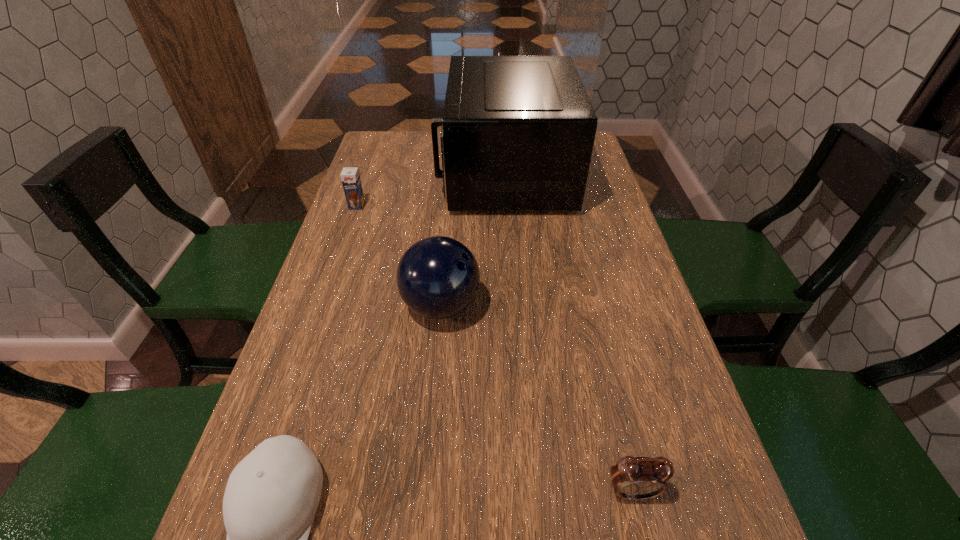
Find the location of `unoccupied area between the second tallest object and the chocolate milk`. unoccupied area between the second tallest object and the chocolate milk is located at coordinates (399, 256).

This screenshot has height=540, width=960. I want to click on free space between the alarm clock and the tallest object, so click(568, 332).

The width and height of the screenshot is (960, 540). Find the location of `vacant area between the alarm clock and the chocolate milk`. vacant area between the alarm clock and the chocolate milk is located at coordinates (494, 348).

What are the coordinates of `unoccupied position between the alarm clock and the microwave_oven` in the screenshot? It's located at (568, 332).

Locate an element on the screen. Image resolution: width=960 pixels, height=540 pixels. empty space between the alarm clock and the third nearest object is located at coordinates [537, 398].

You are a GUI agent. You are given a task and a screenshot of the screen. Output one action in this format:
    pyautogui.click(x=<x>, y=<y>)
    Task: Click on the object that stands as the third closest to the chocolate milk
    This screenshot has width=960, height=540.
    Given the screenshot: What is the action you would take?
    pyautogui.click(x=271, y=497)

What are the coordinates of `object that can be found as the fourth closest to the alarm clock` in the screenshot? It's located at (350, 177).

The width and height of the screenshot is (960, 540). What are the coordinates of `vacant region that satisfies the following two spatial constraints: 1. on the front-facing side of the tallest object; 2. on the front label of the chocolate milk` in the screenshot? It's located at (506, 206).

You are a GUI agent. You are given a task and a screenshot of the screen. Output one action in this format:
    pyautogui.click(x=<x>, y=<y>)
    Task: Click on the vacant space that satisfies the following two spatial constraints: 1. on the front-facing side of the tallest object; 2. on the front label of the chocolate milk
    This screenshot has height=540, width=960.
    Given the screenshot: What is the action you would take?
    pyautogui.click(x=506, y=206)